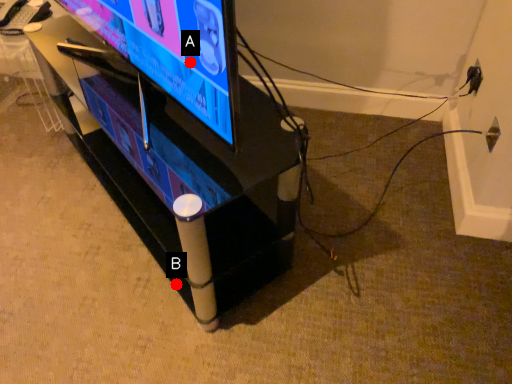
Question: Two points are circled on the image, labeled by A and B beside each circle. Which point is closer to the camera?

Choices:
 (A) A is closer
 (B) B is closer

Answer: (A)